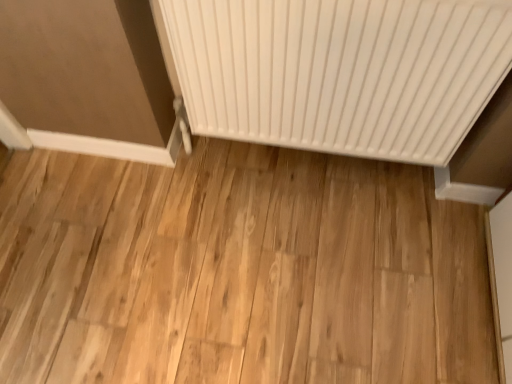
This screenshot has width=512, height=384. In order to click on vacant space underneath white ribbed radiator at center (from a real-world perspective) in this screenshot , I will do `click(302, 167)`.